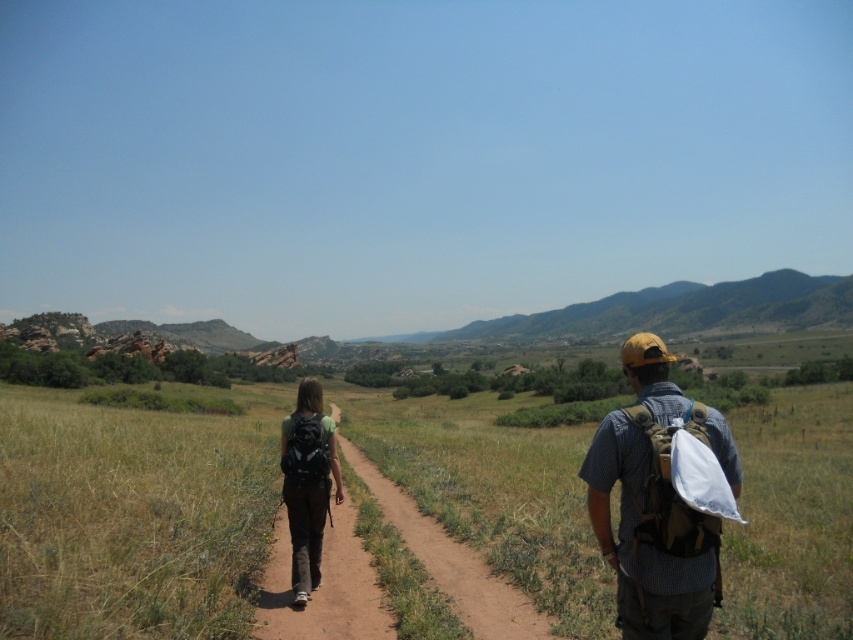
Question: Which object is positioned closest to the matte black backpack at center?

Choices:
 (A) tan canvas backpack at right
 (B) matte khaki cap at upper right

Answer: (B)

Question: Which object is positioned farthest from the black fabric backpack at center?

Choices:
 (A) brown dirt path at center
 (B) green grassy at center
 (C) matte khaki cap at upper right
 (D) tan canvas backpack at right

Answer: (B)

Question: Does tan canvas backpack at right appear on the right side of matte black backpack at center?

Choices:
 (A) yes
 (B) no

Answer: (A)

Question: Which object is positioned closest to the matte black backpack at center?

Choices:
 (A) black fabric backpack at center
 (B) matte khaki cap at upper right

Answer: (A)

Question: Can you confirm if matte khaki cap at upper right is positioned to the right of matte black backpack at center?

Choices:
 (A) yes
 (B) no

Answer: (A)

Question: Can you confirm if tan canvas backpack at right is smaller than matte black backpack at center?

Choices:
 (A) yes
 (B) no

Answer: (B)